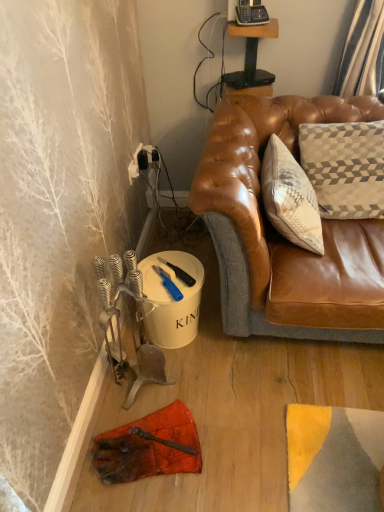
Question: Is blue plastic utility knife at lower center, the first tool when ordered from bottom to top, to the left or to the right of blue plastic knife at lower center, the first tool from the top, in the image?

Choices:
 (A) left
 (B) right

Answer: (A)

Question: Looking at the image, does blue plastic utility knife at lower center, the 2th tool when ordered from top to bottom, seem bigger or smaller compared to blue plastic knife at lower center, arranged as the 2th tool when ordered from the bottom?

Choices:
 (A) big
 (B) small

Answer: (A)

Question: Which is nearer to the blue plastic knife at lower center, arranged as the 2th tool when ordered from the bottom?

Choices:
 (A) blue plastic utility knife at lower center, the 2th tool when ordered from top to bottom
 (B) wooden table at upper center

Answer: (A)

Question: Based on their relative distances, which object is farther from the blue plastic knife at lower center, the first tool from the top?

Choices:
 (A) blue plastic utility knife at lower center, the 2th tool when ordered from top to bottom
 (B) wooden table at upper center

Answer: (B)